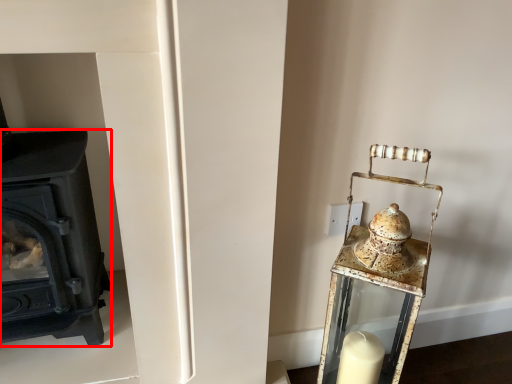
Question: From the image's perspective, where is wood burning stove (annotated by the red box) located in relation to table lamp in the image?

Choices:
 (A) below
 (B) above

Answer: (B)